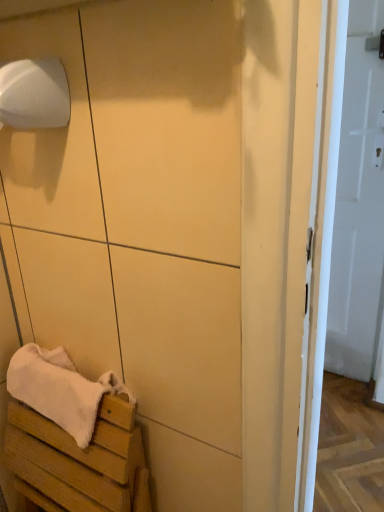
Question: From the image's perspective, is white wood bench at lower left above or below white glossy door at right?

Choices:
 (A) above
 (B) below

Answer: (B)

Question: In terms of size, does white wood bench at lower left appear bigger or smaller than white glossy door at right?

Choices:
 (A) small
 (B) big

Answer: (B)

Question: Which object is the farthest from the white soft towel at lower left?

Choices:
 (A) white matte toilet paper at upper left
 (B) white glossy door at right
 (C) wooden crate at lower left
 (D) white wood bench at lower left

Answer: (B)

Question: Which is nearer to the white glossy door at right?

Choices:
 (A) wooden crate at lower left
 (B) white soft towel at lower left
 (C) white wood bench at lower left
 (D) white matte toilet paper at upper left

Answer: (A)